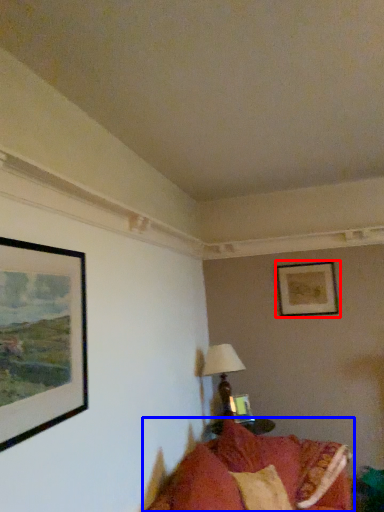
Question: Which point is further to the camera, picture frame (highlighted by a red box) or studio couch (highlighted by a blue box)?

Choices:
 (A) picture frame
 (B) studio couch

Answer: (A)